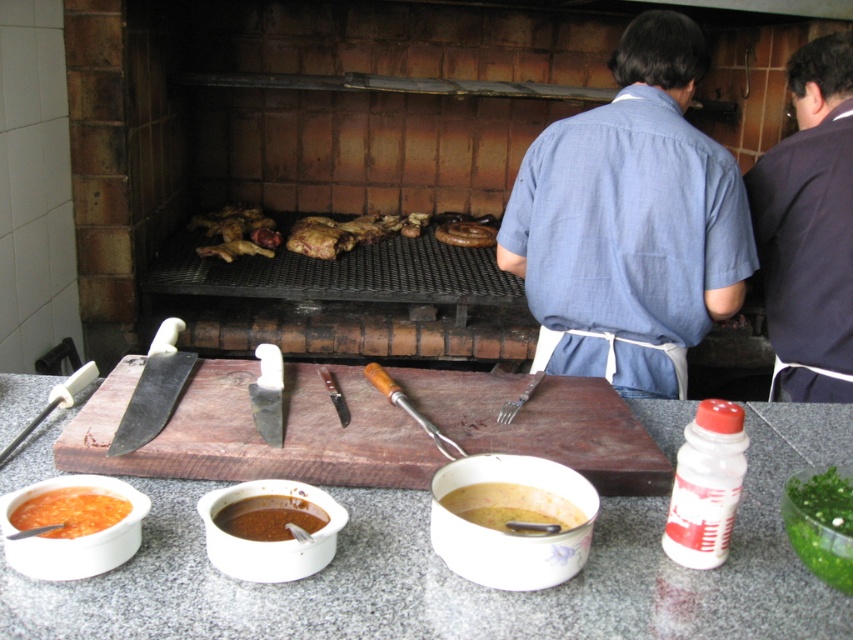
You are preparing to place a hot pot on the granite gray counter top at lower center. However, there is a brown matte soup at lower center in the way. Based on their positions, can you move the soup bowl to the right side of the counter to make space?

The granite gray counter top at lower center is in front of the brown matte soup at lower center, meaning the soup is behind the counter. Since the counter itself is the surface, the soup must be on the counter. To make space, you can move the brown matte soup at lower center to the right side of the counter.

You are a chef preparing a meal and need to reach for the brown matte soup at lower center. However, there is a blue cotton shirt at center in your way. Can you move the shirt to access the soup?

The blue cotton shirt at center is located above the brown matte soup at lower center. Therefore, you can move the shirt to access the soup below it.